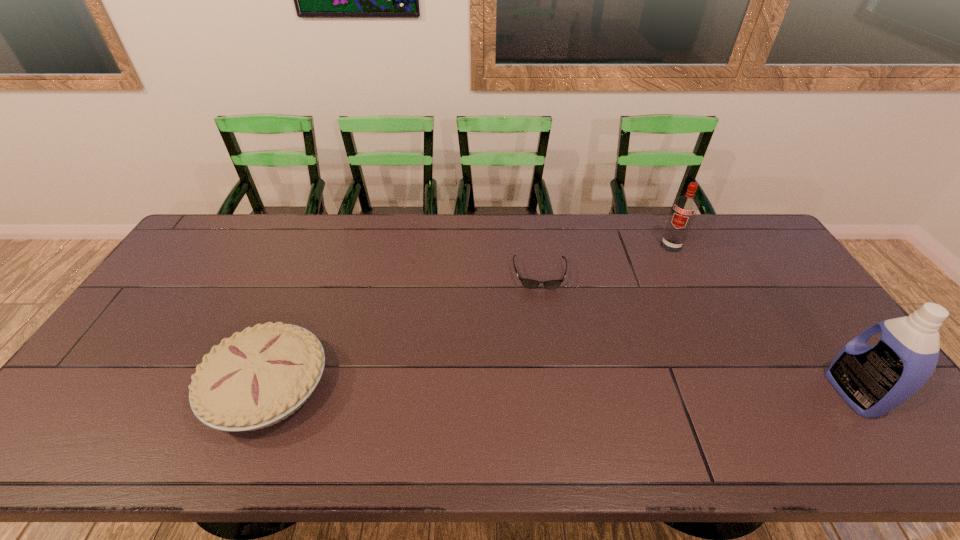
Identify the location of free spot on the desktop that is between the pie and the tallest object and is positioned on the front label of the farthest object. The height and width of the screenshot is (540, 960). (585, 390).

In order to click on vacant spot on the desktop that is between the third tallest object and the detergent and is positioned on the front-facing side of the second farthest object in this screenshot , I will do `click(548, 390)`.